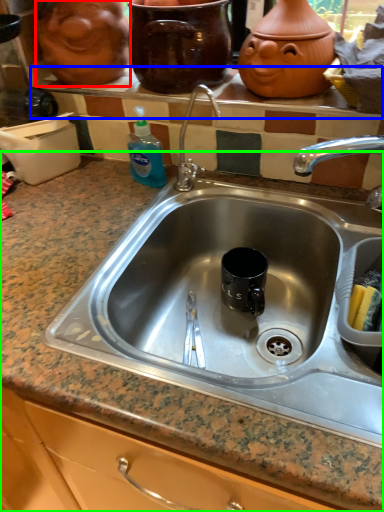
Question: Based on their relative distances, which object is farther from face (highlighted by a red box)? Choose from window sill (highlighted by a blue box) and countertop (highlighted by a green box).

Choices:
 (A) window sill
 (B) countertop

Answer: (B)